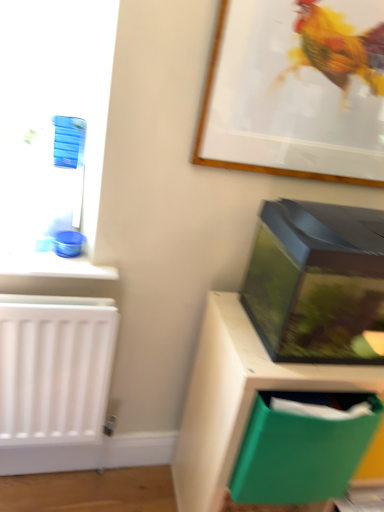
Question: Is transparent plastic aquarium at right wider or thinner than green plastic file at lower right?

Choices:
 (A) thin
 (B) wide

Answer: (A)

Question: Is transparent plastic aquarium at right in front of or behind green plastic file at lower right in the image?

Choices:
 (A) front
 (B) behind

Answer: (A)

Question: Estimate the real-world distances between objects in this image. Which object is closer to the green plastic file at lower right?

Choices:
 (A) green plastic folder at lower right
 (B) wooden picture frame at upper center
 (C) transparent plastic aquarium at right

Answer: (A)

Question: Based on their relative distances, which object is nearer to the transparent plastic aquarium at right?

Choices:
 (A) green plastic file at lower right
 (B) wooden picture frame at upper center
 (C) green plastic folder at lower right

Answer: (A)